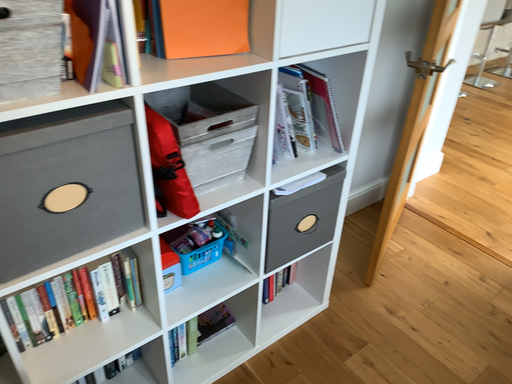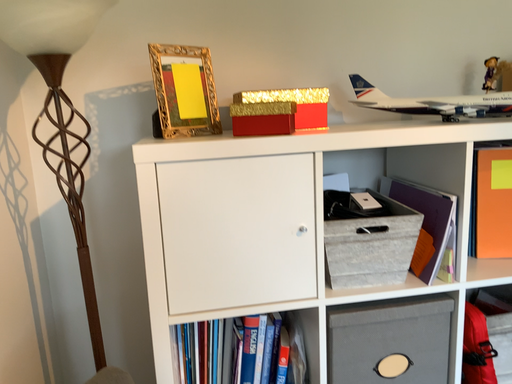
Question: How did the camera likely rotate when shooting the video?

Choices:
 (A) rotated right
 (B) rotated left

Answer: (B)